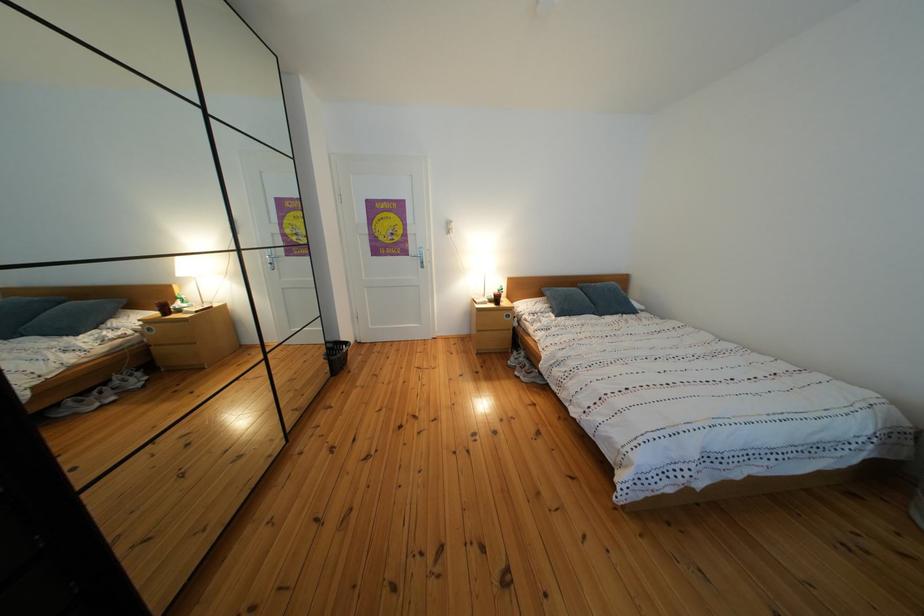
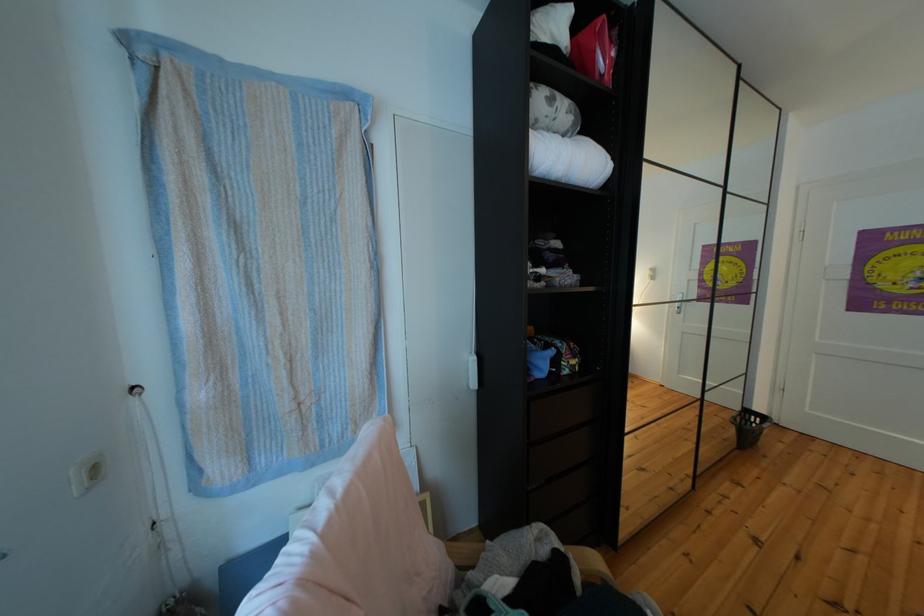
Question: How did the camera likely rotate?

Choices:
 (A) Left
 (B) Right
 (C) Up
 (D) Down

Answer: (A)